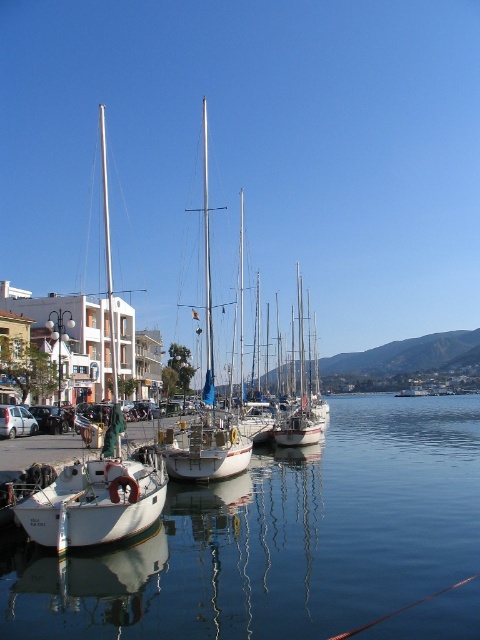
You are a photographer planning to capture the reflection of the white matte sailboat at left and the white matte sailboat at center in the calm water. Which boat will have a more distorted reflection due to the water ripples?

The white matte sailboat at left has a larger size compared to white matte sailboat at center. Since larger objects have more surface area interacting with water ripples, its reflection will be more distorted.

You are standing on the pier and looking at the clear glass water at lower left and the white matte sailboat at left. Which object is positioned lower in the scene?

The clear glass water at lower left is located below the white matte sailboat at left, so it is positioned lower in the scene.